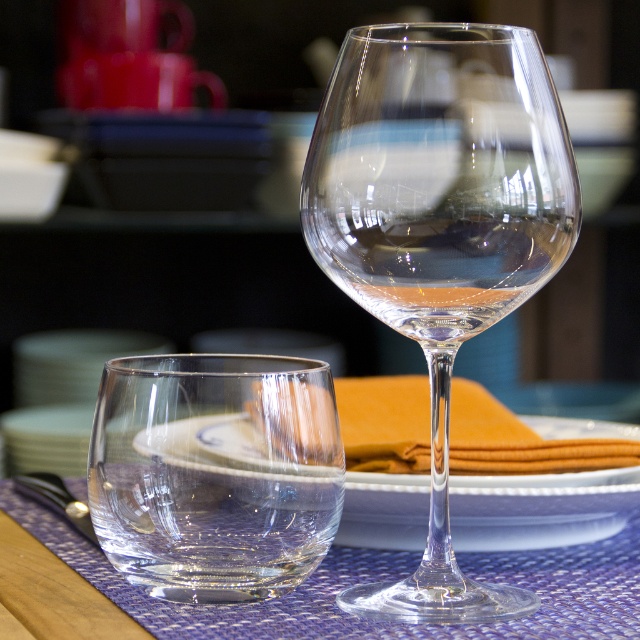
What do you see at coordinates (440, 230) in the screenshot? The width and height of the screenshot is (640, 640). I see `transparent glass wine glass at center` at bounding box center [440, 230].

Who is taller, transparent glass wine glass at center or polished silver fork at lower left?

transparent glass wine glass at center

Who is more forward, (333,268) or (22,490)?

Point (333,268) is more forward.

Identify the location of transparent glass wine glass at center. (440, 230).

Describe the element at coordinates (440, 266) in the screenshot. Image resolution: width=640 pixels, height=640 pixels. I see `transparent glass wine at center` at that location.

The image size is (640, 640). Find the location of `transparent glass wine at center`. transparent glass wine at center is located at coordinates (440, 266).

Does transparent glass at lower left have a greater height compared to blue woven placemat at center?

Yes, transparent glass at lower left is taller than blue woven placemat at center.

The image size is (640, 640). Describe the element at coordinates (214, 472) in the screenshot. I see `transparent glass at lower left` at that location.

The height and width of the screenshot is (640, 640). Identify the location of transparent glass at lower left. (214, 472).